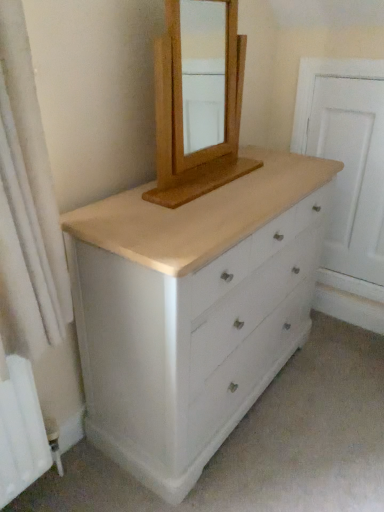
Question: Does white painted wood chest of drawers at center come in front of white wood screen door at right?

Choices:
 (A) yes
 (B) no

Answer: (A)

Question: Is white painted wood chest of drawers at center not near white wood screen door at right?

Choices:
 (A) no
 (B) yes

Answer: (A)

Question: Considering the relative sizes of white painted wood chest of drawers at center and white wood screen door at right in the image provided, is white painted wood chest of drawers at center thinner than white wood screen door at right?

Choices:
 (A) no
 (B) yes

Answer: (A)

Question: Is white painted wood chest of drawers at center facing towards white wood screen door at right?

Choices:
 (A) yes
 (B) no

Answer: (B)

Question: Is white painted wood chest of drawers at center in contact with white wood screen door at right?

Choices:
 (A) no
 (B) yes

Answer: (A)

Question: Considering the positions of white fabric shower curtain at left and white wood screen door at right in the image, is white fabric shower curtain at left taller or shorter than white wood screen door at right?

Choices:
 (A) short
 (B) tall

Answer: (A)

Question: Is point (46, 288) closer or farther from the camera than point (380, 121)?

Choices:
 (A) closer
 (B) farther

Answer: (A)

Question: From the image's perspective, is white fabric shower curtain at left above or below white wood screen door at right?

Choices:
 (A) below
 (B) above

Answer: (A)

Question: Based on their positions, is white fabric shower curtain at left located to the left or right of white wood screen door at right?

Choices:
 (A) left
 (B) right

Answer: (A)

Question: Which is correct: natural wood mirror at upper center is inside white wood screen door at right, or outside of it?

Choices:
 (A) inside
 (B) outside

Answer: (B)

Question: From the image's perspective, is natural wood mirror at upper center located above or below white wood screen door at right?

Choices:
 (A) above
 (B) below

Answer: (A)

Question: From their relative heights in the image, would you say natural wood mirror at upper center is taller or shorter than white wood screen door at right?

Choices:
 (A) short
 (B) tall

Answer: (A)

Question: In the image, is natural wood mirror at upper center positioned in front of or behind white wood screen door at right?

Choices:
 (A) front
 (B) behind

Answer: (A)

Question: In the image, is white painted wood chest of drawers at center positioned in front of or behind natural wood mirror at upper center?

Choices:
 (A) front
 (B) behind

Answer: (A)

Question: Is white painted wood chest of drawers at center situated inside natural wood mirror at upper center or outside?

Choices:
 (A) outside
 (B) inside

Answer: (A)